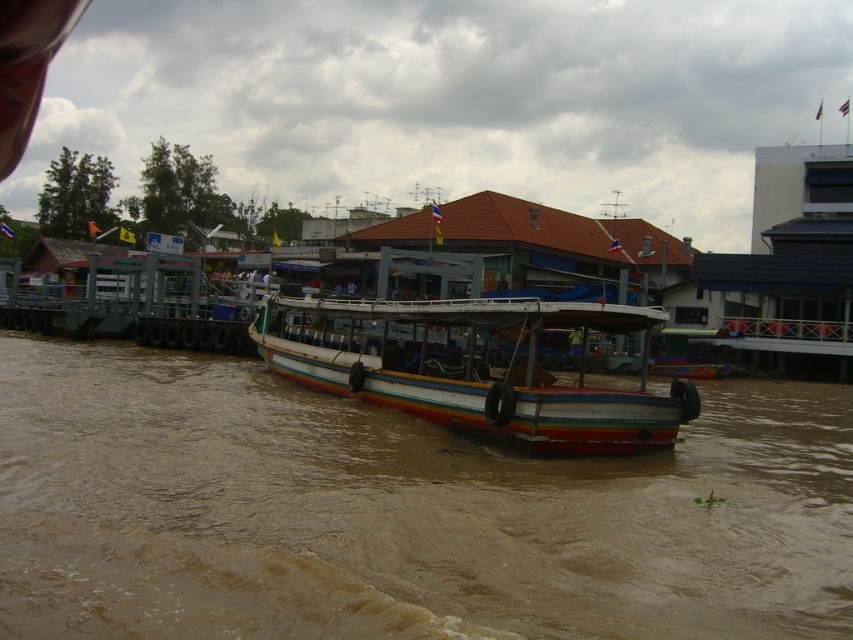
Who is lower down, brown muddy water at center or rainbow painted wood boat at center?

brown muddy water at center

Is point (770, 528) less distant than point (654, 444)?

That is True.

This screenshot has height=640, width=853. I want to click on brown muddy water at center, so click(x=398, y=513).